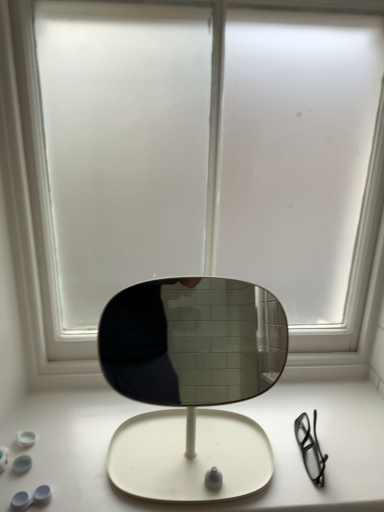
Identify the location of blank space situated above white matte table at center (from a real-world perspective). (201, 438).